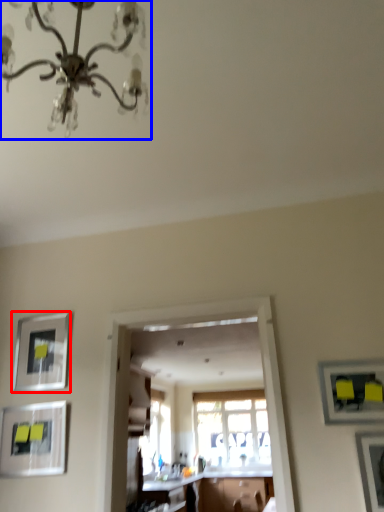
Question: Which point is further to the camera, picture frame (highlighted by a red box) or chandelier (highlighted by a blue box)?

Choices:
 (A) picture frame
 (B) chandelier

Answer: (A)